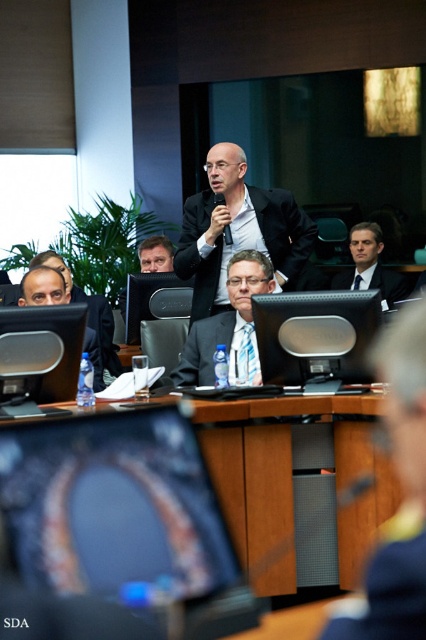
Which is above, satin blue suit at center or blue striped tie at center?

Positioned higher is satin blue suit at center.

Does satin blue suit at center have a smaller size compared to blue striped tie at center?

No, satin blue suit at center is not smaller than blue striped tie at center.

Between point (232, 371) and point (213, 337), which one is positioned behind?

The point (213, 337) is more distant.

Find the location of `satin blue suit at center`. satin blue suit at center is located at coordinates (227, 321).

Is black plastic monitor at center taller than black matte suit at center?

No.

Does black plastic monitor at center have a lesser height compared to black matte suit at center?

Yes, black plastic monitor at center is shorter than black matte suit at center.

Between point (321, 305) and point (193, 218), which one is positioned in front?

Positioned in front is point (321, 305).

Locate an element on the screen. This screenshot has height=640, width=426. black plastic monitor at center is located at coordinates (316, 333).

Can you confirm if black matte suit at center is positioned to the left of matte black suit at center?

No, black matte suit at center is not to the left of matte black suit at center.

At what (x,y) coordinates should I click in order to perform the action: click on black matte suit at center. Please return your answer as a coordinate pair (x, y). The image size is (426, 640). Looking at the image, I should click on (241, 243).

Image resolution: width=426 pixels, height=640 pixels. I want to click on black matte suit at center, so click(x=241, y=243).